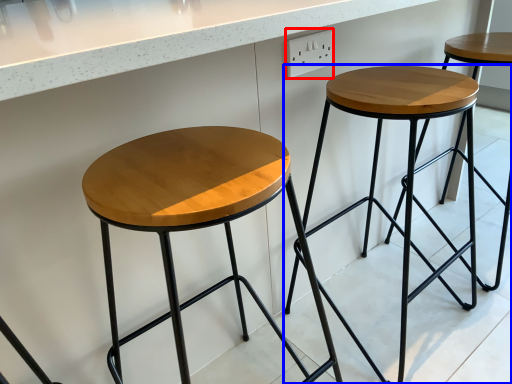
Question: Which point is further to the camera, electric outlet (highlighted by a red box) or stool (highlighted by a blue box)?

Choices:
 (A) electric outlet
 (B) stool

Answer: (A)